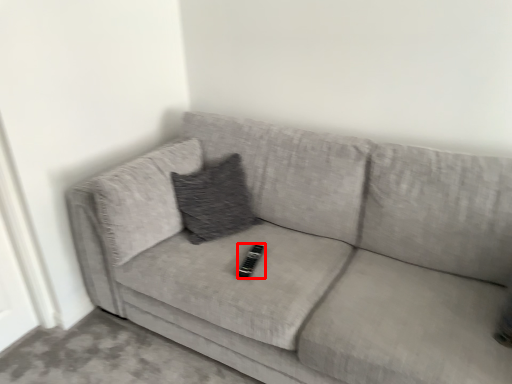
Question: From the image's perspective, where is remote (annotated by the red box) located relative to studio couch?

Choices:
 (A) below
 (B) above

Answer: (A)